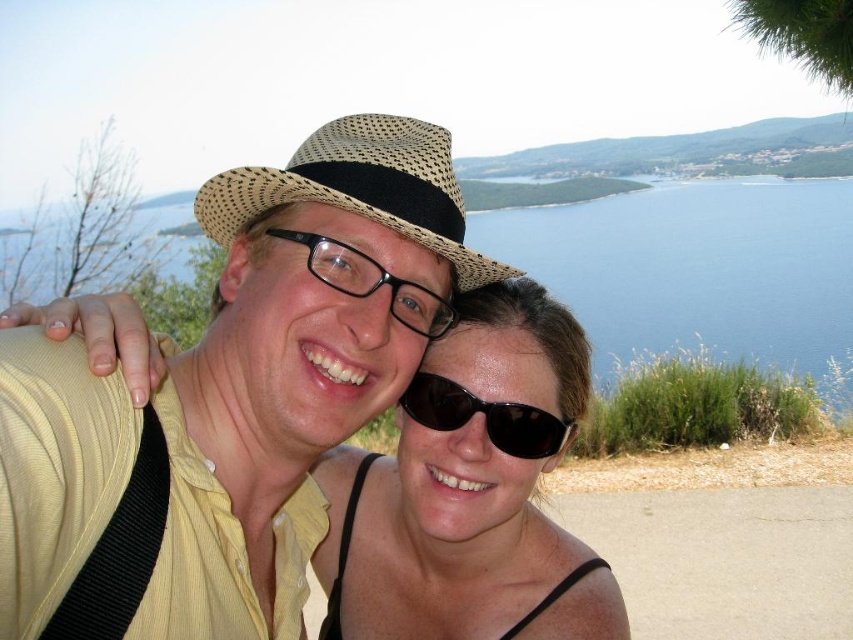
Question: Observing the image, what is the correct spatial positioning of sunglasses at center in reference to black plastic glasses at center?

Choices:
 (A) left
 (B) right

Answer: (B)

Question: Which point is farther to the camera?

Choices:
 (A) sunglasses at center
 (B) matte straw hat at center

Answer: (A)

Question: Is natural straw hat at center smaller than black plastic sunglasses at center?

Choices:
 (A) no
 (B) yes

Answer: (A)

Question: Which of the following is the closest to the observer?

Choices:
 (A) sunglasses at center
 (B) black plastic sunglasses at center
 (C) blue water at upper center
 (D) black plastic glasses at center

Answer: (D)

Question: Which object is closer to the camera taking this photo?

Choices:
 (A) natural straw hat at center
 (B) black plastic sunglasses at center
 (C) matte straw hat at center
 (D) sunglasses at center

Answer: (C)

Question: Is blue water at upper center positioned at the back of black plastic sunglasses at center?

Choices:
 (A) yes
 (B) no

Answer: (A)